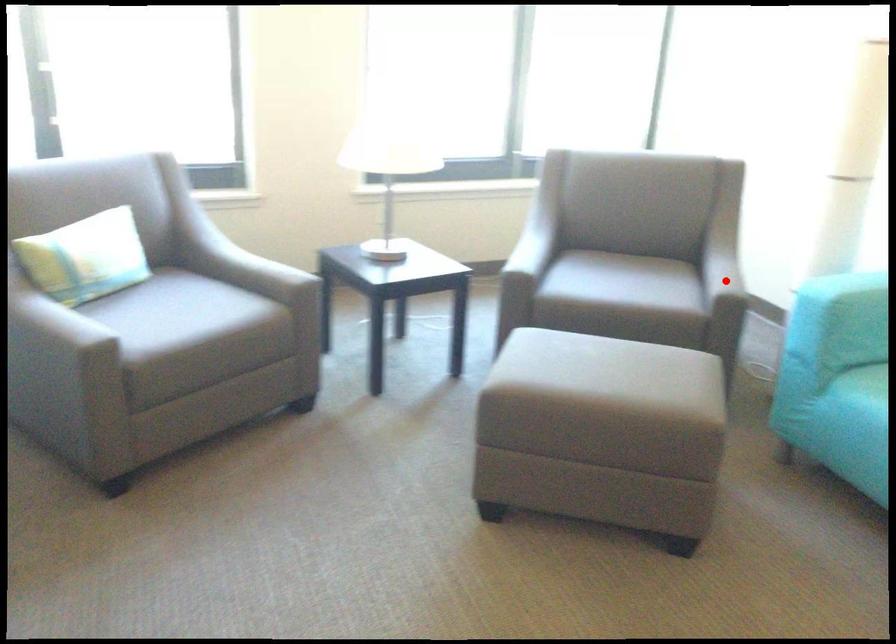
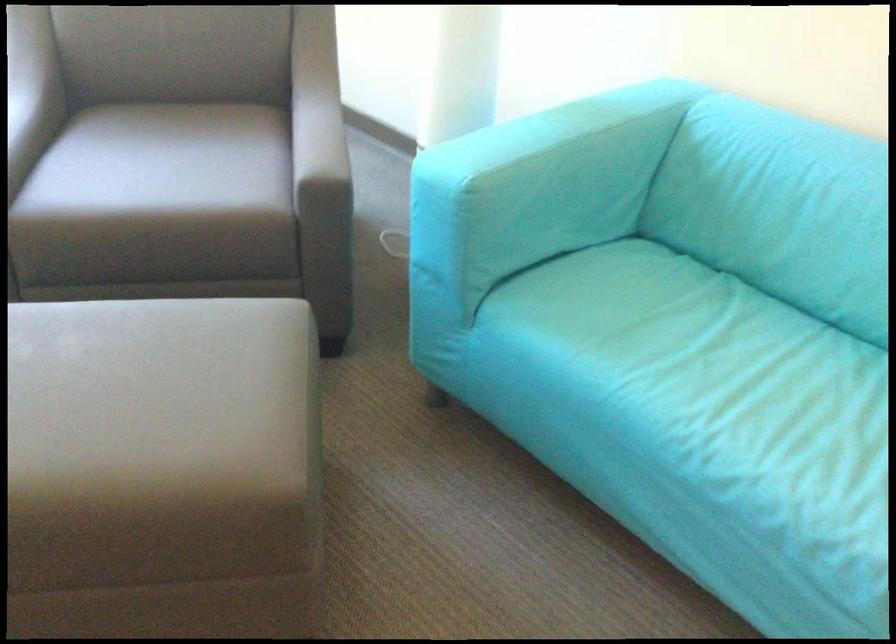
Locate, in the second image, the point that corresponds to the highlighted location in the first image.

(330, 149)